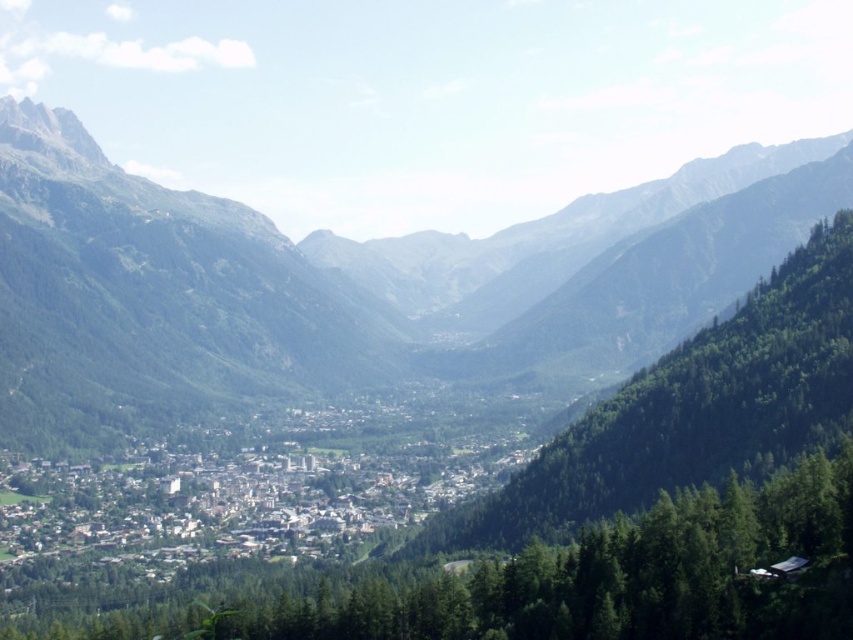
Does green forested mountain at center have a greater width compared to green leafy trees at center?

Yes.

Is green forested mountain at center to the right of green leafy trees at center from the viewer's perspective?

Incorrect, green forested mountain at center is not on the right side of green leafy trees at center.

Image resolution: width=853 pixels, height=640 pixels. I want to click on green forested mountain at center, so click(335, 280).

Does green forested mountain at center appear on the right side of green textured trees at center?

Correct, you'll find green forested mountain at center to the right of green textured trees at center.

Locate an element on the screen. Image resolution: width=853 pixels, height=640 pixels. green forested mountain at center is located at coordinates (335, 280).

Is point (607, 300) more distant than point (782, 538)?

Yes, it is behind point (782, 538).

The height and width of the screenshot is (640, 853). I want to click on green forested mountain at center, so click(335, 280).

Is point (718, 604) farther from viewer compared to point (781, 326)?

No, it is in front of (781, 326).

The height and width of the screenshot is (640, 853). Describe the element at coordinates (579, 580) in the screenshot. I see `green textured trees at center` at that location.

Locate an element on the screen. green textured trees at center is located at coordinates (579, 580).